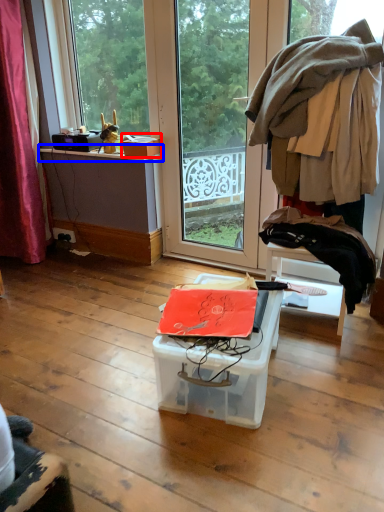
Question: Which object is closer to the camera taking this photo, storage box (highlighted by a red box) or window sill (highlighted by a blue box)?

Choices:
 (A) storage box
 (B) window sill

Answer: (A)